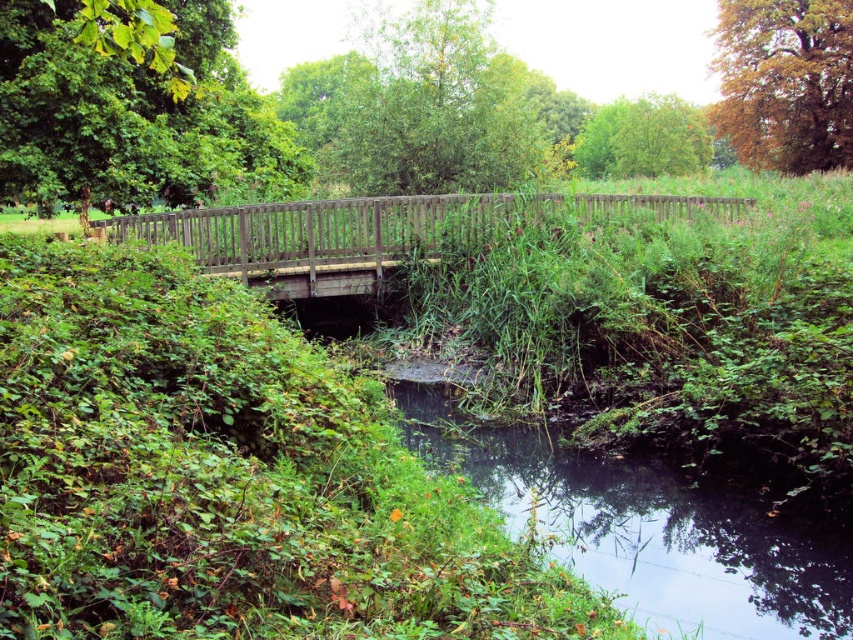
Question: Among these points, which one is farthest from the camera?

Choices:
 (A) (662, 528)
 (B) (59, 170)
 (C) (737, 214)
 (D) (753, 92)

Answer: (D)

Question: Is the position of green grassy river at lower center more distant than that of green matte tree at upper left?

Choices:
 (A) yes
 (B) no

Answer: (B)

Question: Which point is closer to the camera?

Choices:
 (A) wooden bridge at center
 (B) green grassy river at lower center
 (C) green matte tree at upper left
 (D) green leafy tree at upper center

Answer: (B)

Question: Among these objects, which one is farthest from the camera?

Choices:
 (A) wooden bridge at center
 (B) green matte tree at upper left

Answer: (B)

Question: Is green grassy river at lower center above green leafy tree at upper center?

Choices:
 (A) no
 (B) yes

Answer: (A)

Question: In this image, where is wooden bridge at center located relative to green leafy tree at upper center?

Choices:
 (A) above
 (B) below

Answer: (B)